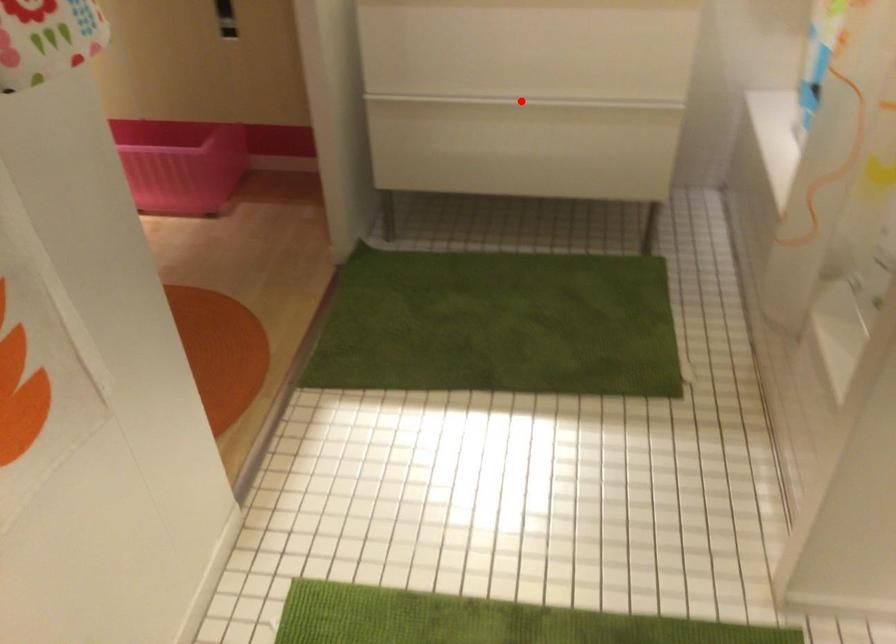
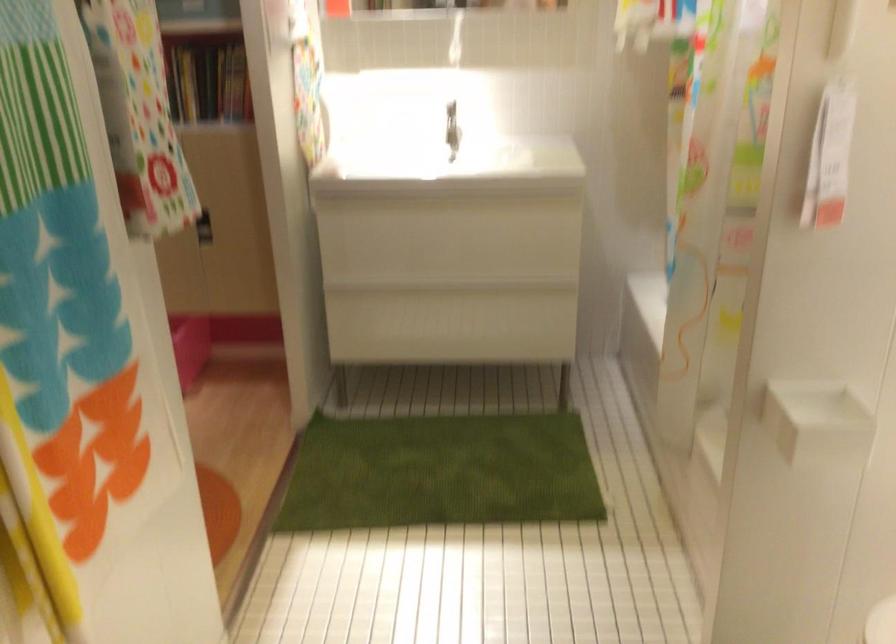
Question: I am providing you with two images of the same scene from different viewpoints. A red point is marked on the first image. Is the red point's position out of view in image 2?

Choices:
 (A) Yes
 (B) No

Answer: (B)